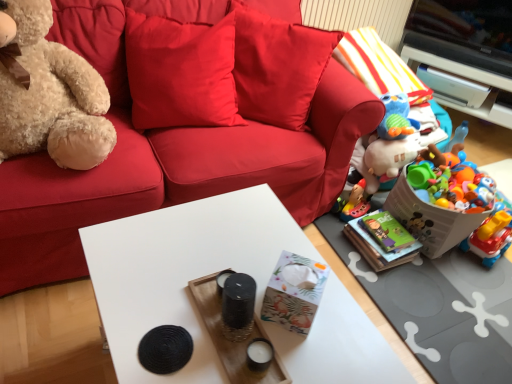
The height and width of the screenshot is (384, 512). What are the coordinates of `free space on the front side of plastic colorful toys at right, the 2th toy when ordered from right to left` in the screenshot? It's located at (448, 299).